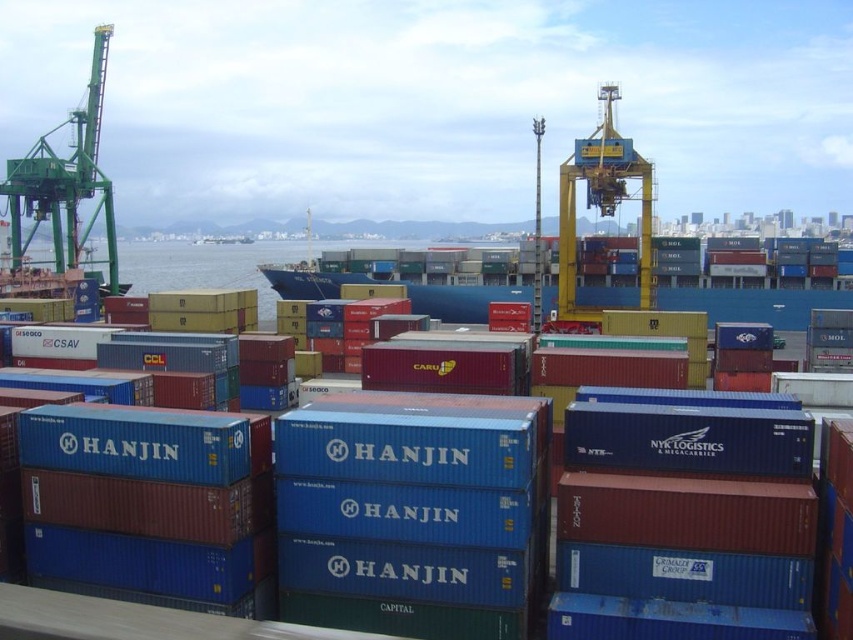
You are standing at the point with coordinates point (741, 545) and want to walk to the point with coordinates point (84, 180). Which direction should you move to get closer to your destination?

To move from point (741, 545) to point (84, 180), you should move towards the lower left direction since point (84, 180) is located to the lower left of point (741, 545).

You are a crane operator trying to move the blue matte container at center. The green painted metal crane at left is blocking your path. Can you move the container without moving the crane?

The blue matte container at center is positioned on the right side of the green painted metal crane at left, so the crane is not directly blocking the path. You can move the container without moving the crane.